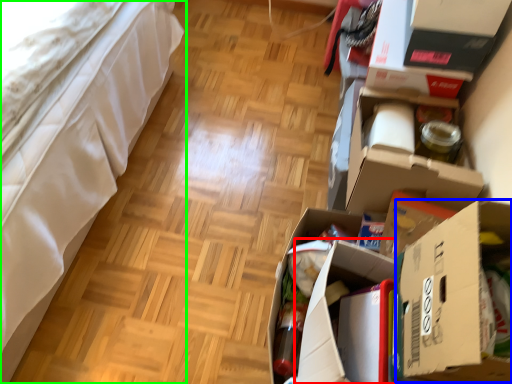
Question: Considering the real-world distances, which object is closest to cardboard box (highlighted by a red box)? cardboard box (highlighted by a blue box) or furniture (highlighted by a green box).

Choices:
 (A) cardboard box
 (B) furniture

Answer: (A)